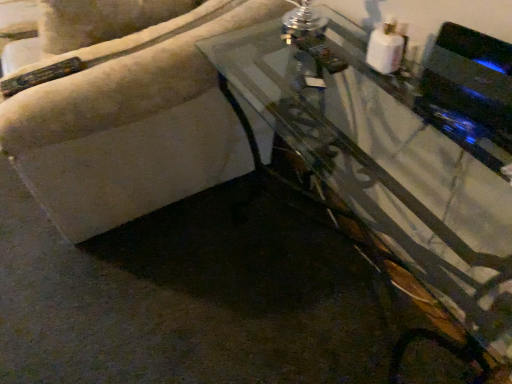
This screenshot has width=512, height=384. I want to click on free space to the left of black glossy speaker at upper right, so click(381, 129).